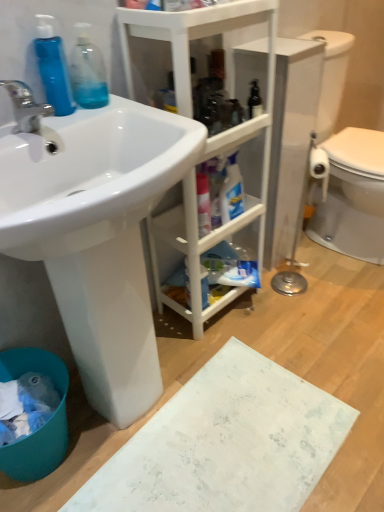
Locate an element on the screen. unoccupied region to the right of blue plastic bottle at left, which appears as the second cleaning product when viewed from the right is located at coordinates (113, 109).